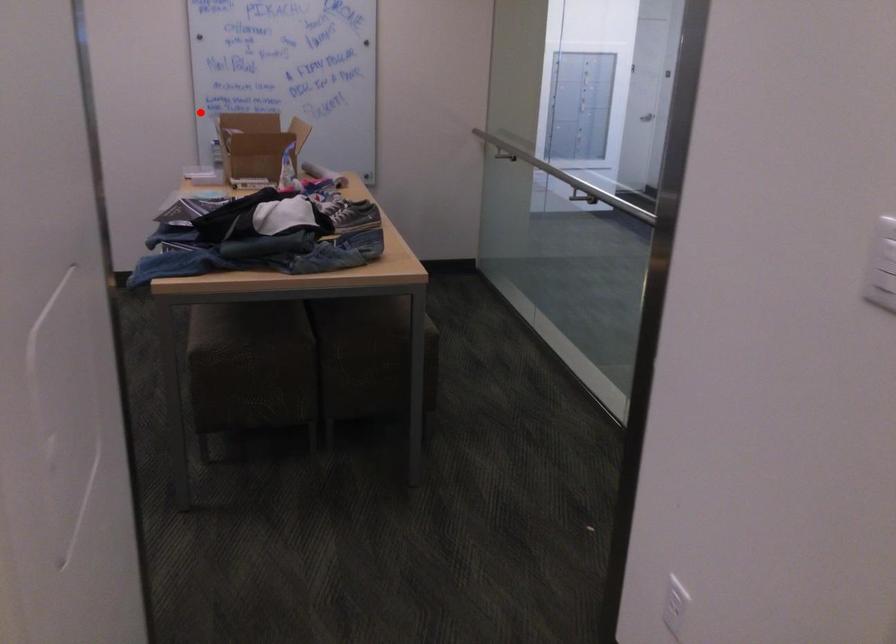
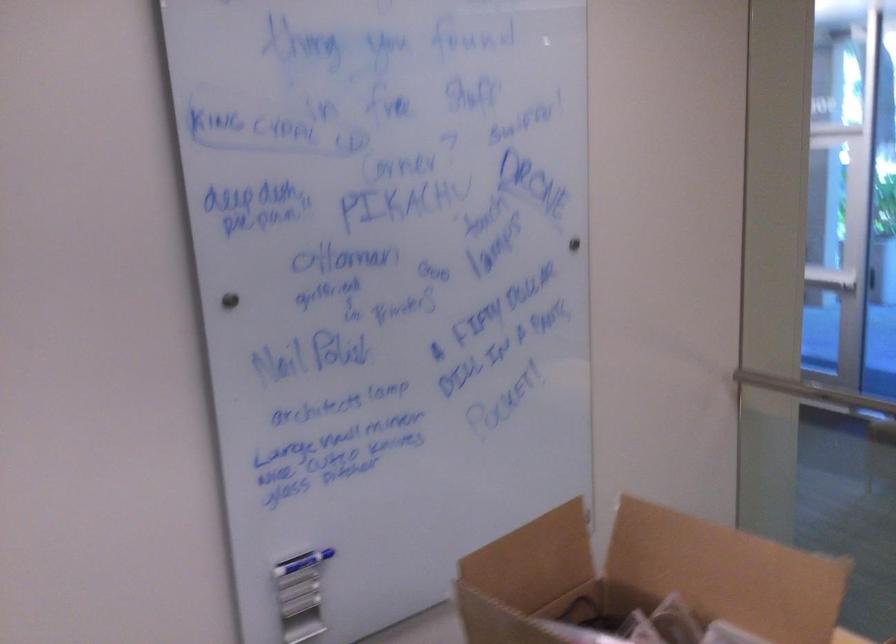
Where in the second image is the point corresponding to the highlighted location from the first image?

(302, 562)